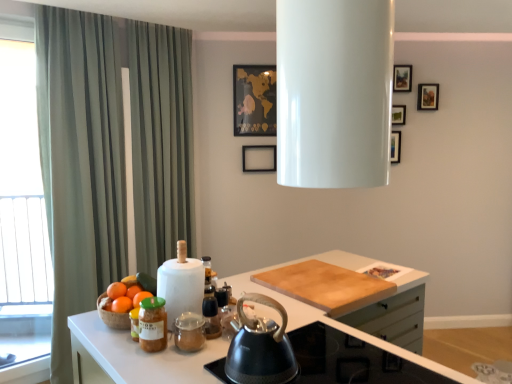
The height and width of the screenshot is (384, 512). I want to click on vacant area that is in front of white paper towel at center, which appears as the first appliance when viewed from the left, so click(164, 350).